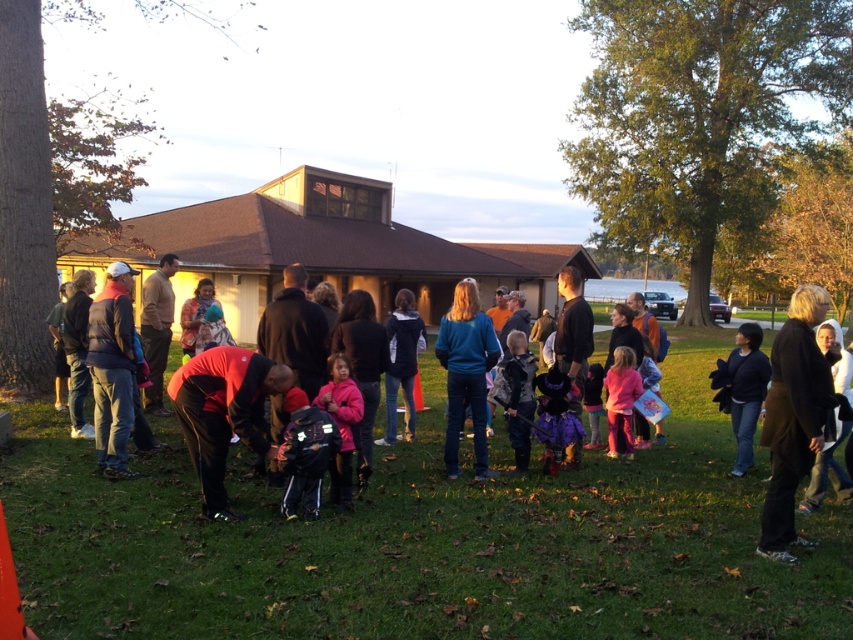
Question: Which object is closer to the camera taking this photo?

Choices:
 (A) matte black backpack at center
 (B) pink matte dress at lower right
 (C) matte pink dress at center
 (D) matte pink jacket at center

Answer: (A)

Question: Where is matte pink jacket at center located in relation to matte pink dress at center in the image?

Choices:
 (A) below
 (B) above

Answer: (B)

Question: In this image, where is matte black backpack at center located relative to matte pink jacket at center?

Choices:
 (A) below
 (B) above

Answer: (B)

Question: Which of these objects is positioned closest to the pink matte dress at lower right?

Choices:
 (A) purple satin dress at center
 (B) matte black backpack at center
 (C) matte pink dress at center
 (D) matte pink jacket at center

Answer: (C)

Question: Which point is closer to the camera?

Choices:
 (A) pink matte dress at lower right
 (B) matte pink jacket at center

Answer: (B)

Question: Does purple satin dress at center come in front of pink matte dress at lower right?

Choices:
 (A) no
 (B) yes

Answer: (B)